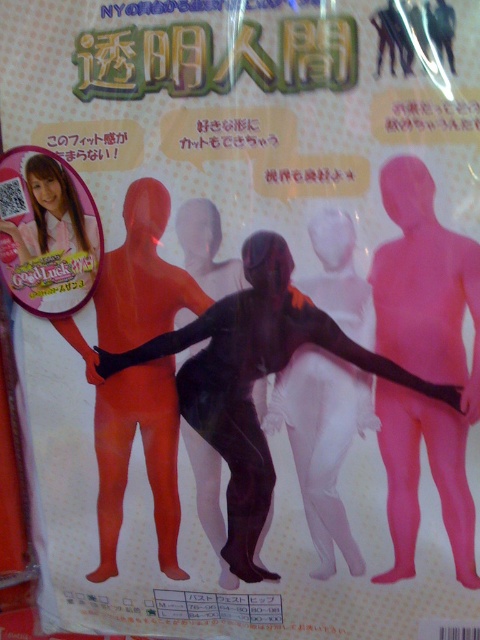
Question: Does pink matte bodysuit at center appear on the right side of black spandex suit at center?

Choices:
 (A) no
 (B) yes

Answer: (B)

Question: Does pink matte bodysuit at center appear on the left side of matte orange spandex at center?

Choices:
 (A) no
 (B) yes

Answer: (A)

Question: Can you confirm if pink matte bodysuit at center is smaller than matte orange spandex at center?

Choices:
 (A) yes
 (B) no

Answer: (A)

Question: Which is farther from the black matte bodysuit at center?

Choices:
 (A) matte orange spandex at center
 (B) pink matte bodysuit at center
 (C) black spandex suit at center

Answer: (A)

Question: Which point is farther to the camera?

Choices:
 (A) matte orange spandex at center
 (B) pink matte bodysuit at center
 (C) black spandex suit at center
 (D) black matte bodysuit at center

Answer: (A)

Question: Which of the following is the closest to the observer?

Choices:
 (A) black matte bodysuit at center
 (B) black spandex suit at center
 (C) matte orange spandex at center

Answer: (A)